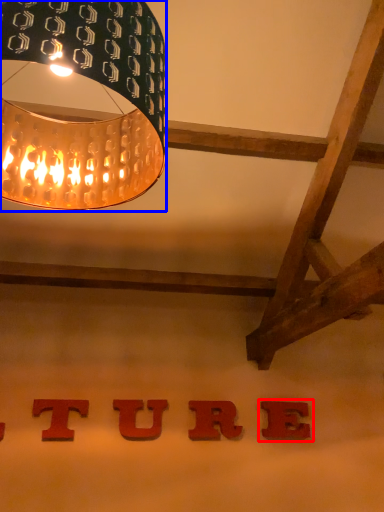
Question: Among these objects, which one is nearest to the camera, alphabet (highlighted by a red box) or lamp (highlighted by a blue box)?

Choices:
 (A) alphabet
 (B) lamp

Answer: (B)